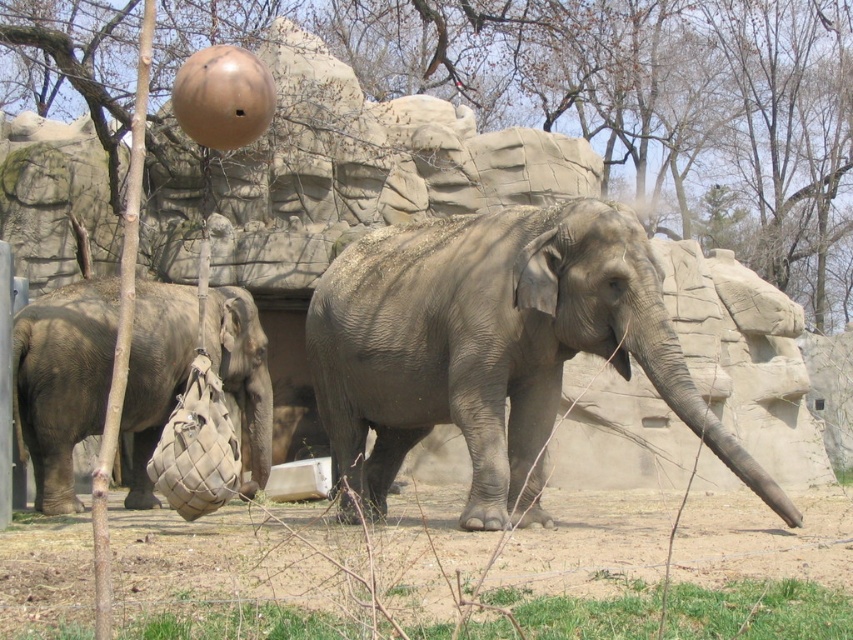
Between gray matte elephant at center and gray matte bag at left, which one has less height?

gray matte bag at left is shorter.

Is point (488, 291) farther from camera compared to point (161, 376)?

That is False.

The height and width of the screenshot is (640, 853). I want to click on gray matte elephant at center, so click(x=491, y=348).